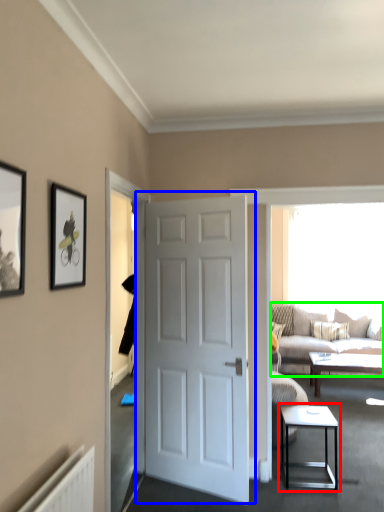
Question: Estimate the real-world distances between objects in this image. Which object is closer to table (highlighted by a red box), door (highlighted by a blue box) or studio couch (highlighted by a green box)?

Choices:
 (A) door
 (B) studio couch

Answer: (A)